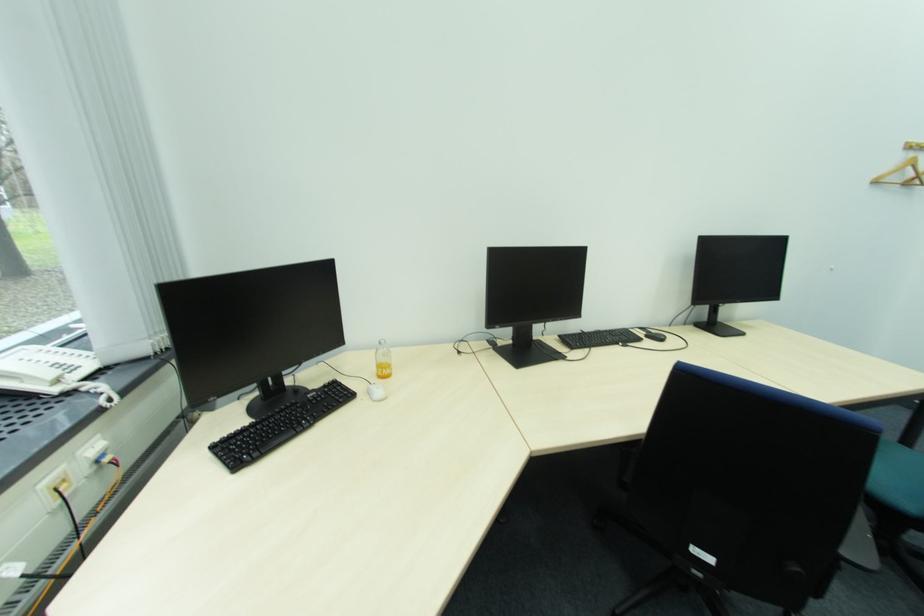
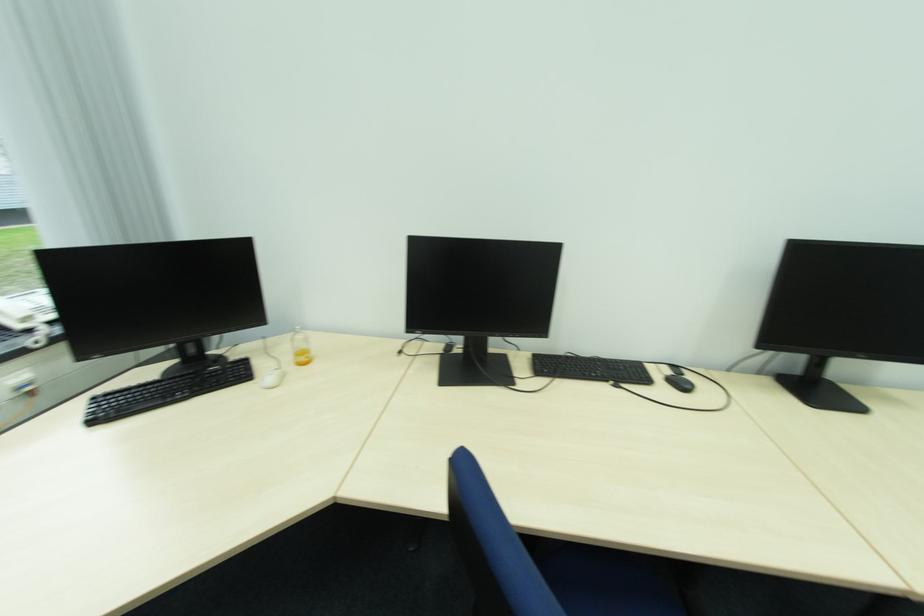
Where in the second image is the point corresponding to pixel 654 336 from the first image?

(677, 379)